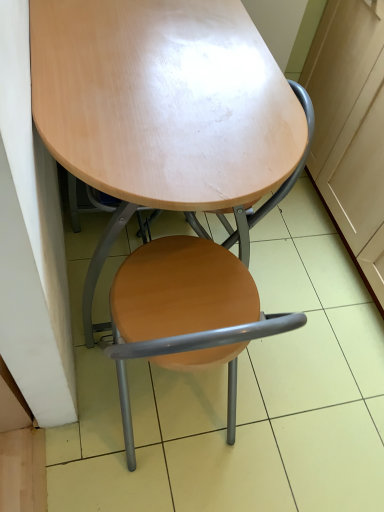
Identify the location of glossy wood table at center. (162, 109).

From the image's perspective, is wooden seat at center above or below matte wood cabinet at right?

Based on their image positions, wooden seat at center is located beneath matte wood cabinet at right.

Locate an element on the screen. The image size is (384, 512). cabinetry above the wooden seat at center (from a real-world perspective) is located at coordinates (348, 114).

Considering the relative sizes of wooden seat at center and matte wood cabinet at right in the image provided, is wooden seat at center smaller than matte wood cabinet at right?

Yes, wooden seat at center is smaller than matte wood cabinet at right.

Considering the relative positions of glossy wood table at center and matte wood cabinet at right in the image provided, is glossy wood table at center to the right of matte wood cabinet at right from the viewer's perspective?

Incorrect, glossy wood table at center is not on the right side of matte wood cabinet at right.

From a real-world perspective, is glossy wood table at center beneath matte wood cabinet at right?

No, from a real-world perspective, glossy wood table at center is not under matte wood cabinet at right.

Which object is thinner, glossy wood table at center or matte wood cabinet at right?

Thinner between the two is glossy wood table at center.

Does point (94, 270) lie behind point (336, 163)?

No, it is not.

Based on the photo, based on their positions, is glossy wood table at center located to the left or right of wooden seat at center?

In the image, glossy wood table at center appears on the left side of wooden seat at center.

Who is bigger, glossy wood table at center or wooden seat at center?

With larger size is glossy wood table at center.

Is glossy wood table at center positioned with its back to wooden seat at center?

glossy wood table at center does not have its back to wooden seat at center.

Looking at this image, is glossy wood table at center far from wooden seat at center?

No.

Looking at this image, which object is further away from the camera, matte wood cabinet at right or glossy wood table at center?

matte wood cabinet at right.

Considering the sizes of matte wood cabinet at right and glossy wood table at center in the image, is matte wood cabinet at right taller or shorter than glossy wood table at center?

Clearly, matte wood cabinet at right is shorter compared to glossy wood table at center.

In terms of width, does matte wood cabinet at right look wider or thinner when compared to glossy wood table at center?

Clearly, matte wood cabinet at right has more width compared to glossy wood table at center.

Is matte wood cabinet at right oriented away from glossy wood table at center?

No, matte wood cabinet at right is not facing away from glossy wood table at center.

Which of these two, wooden seat at center or glossy wood table at center, stands shorter?

With less height is wooden seat at center.

How distant is wooden seat at center from glossy wood table at center?

wooden seat at center is 8.87 inches away from glossy wood table at center.

From the image's perspective, which is above, wooden seat at center or glossy wood table at center?

glossy wood table at center is shown above in the image.

This screenshot has width=384, height=512. What are the coordinates of `chair located on the right of glossy wood table at center` in the screenshot? It's located at (188, 295).

Between matte wood cabinet at right and wooden seat at center, which one has larger size?

matte wood cabinet at right.

Measure the distance from matte wood cabinet at right to wooden seat at center.

25.59 inches.

Is point (348, 41) positioned in front of point (168, 298)?

No, (348, 41) is behind (168, 298).

From the image's perspective, which one is positioned lower, matte wood cabinet at right or wooden seat at center?

wooden seat at center.

Locate an element on the screen. chair in front of the matte wood cabinet at right is located at coordinates (188, 295).

At what (x,y) coordinates should I click in order to perform the action: click on table above the matte wood cabinet at right (from a real-world perspective). Please return your answer as a coordinate pair (x, y). Looking at the image, I should click on (162, 109).

From the picture: Estimate the real-world distances between objects in this image. Which object is further from wooden seat at center, matte wood cabinet at right or glossy wood table at center?

matte wood cabinet at right is further to wooden seat at center.

Based on their spatial positions, is wooden seat at center or glossy wood table at center further from matte wood cabinet at right?

glossy wood table at center.

From the image, which object appears to be nearer to matte wood cabinet at right, glossy wood table at center or wooden seat at center?

wooden seat at center is positioned closer to the anchor matte wood cabinet at right.

From the image, which object appears to be farther from wooden seat at center, glossy wood table at center or matte wood cabinet at right?

The object further to wooden seat at center is matte wood cabinet at right.

Looking at the image, which one is located closer to glossy wood table at center, matte wood cabinet at right or wooden seat at center?

wooden seat at center is closer to glossy wood table at center.

Which object lies further to the anchor point glossy wood table at center, wooden seat at center or matte wood cabinet at right?

matte wood cabinet at right is further to glossy wood table at center.

Where is `chair between glossy wood table at center and matte wood cabinet at right`? chair between glossy wood table at center and matte wood cabinet at right is located at coordinates (188, 295).